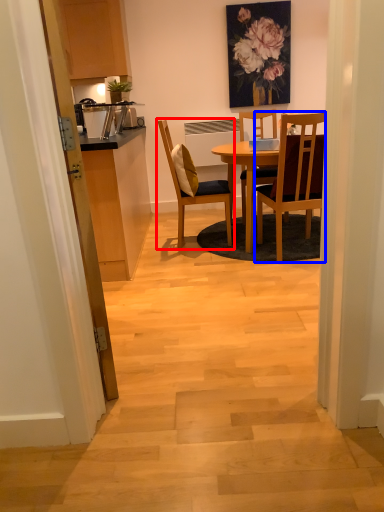
Question: Which object appears farthest to the camera in this image, chair (highlighted by a red box) or chair (highlighted by a blue box)?

Choices:
 (A) chair
 (B) chair

Answer: (A)